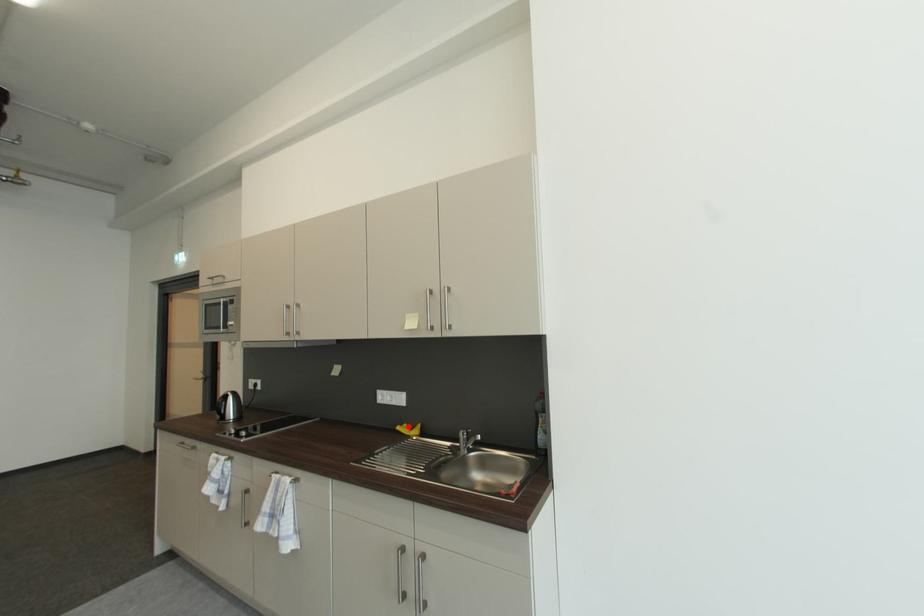
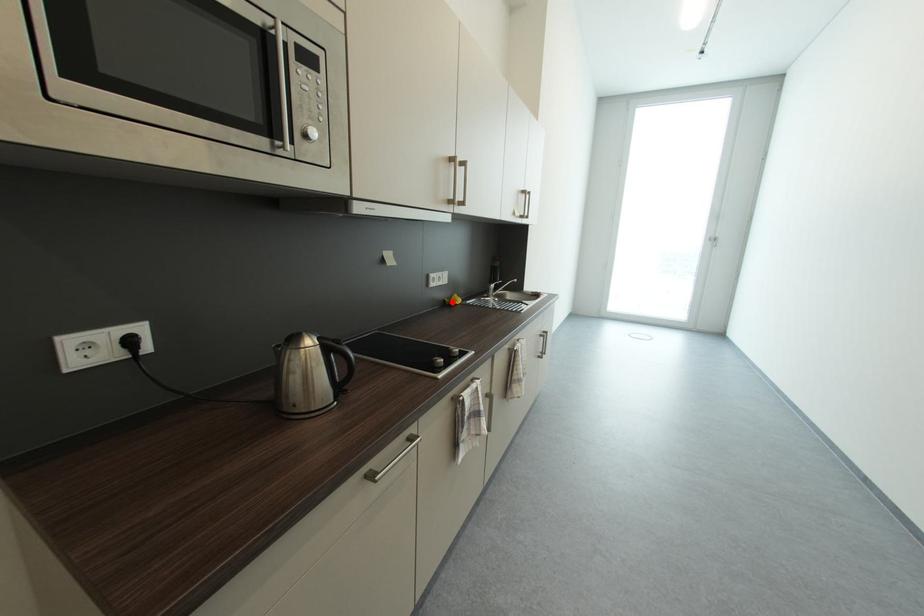
I am providing you with two images of the same scene from different viewpoints. A red point is marked on the first image and another point is marked on the second image. Are the points marked in image1 and image2 representing the same 3D position?

Yes